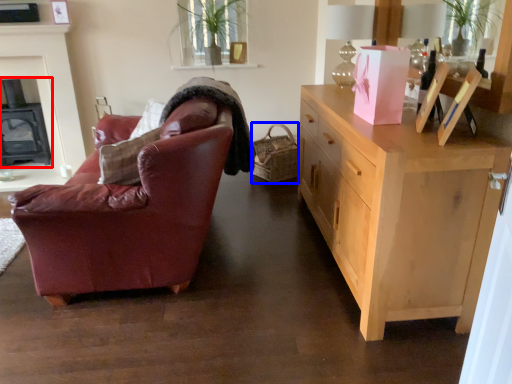
Question: Which of the following is the farthest to the observer, fireplace (highlighted by a red box) or picnic basket (highlighted by a blue box)?

Choices:
 (A) fireplace
 (B) picnic basket

Answer: (A)